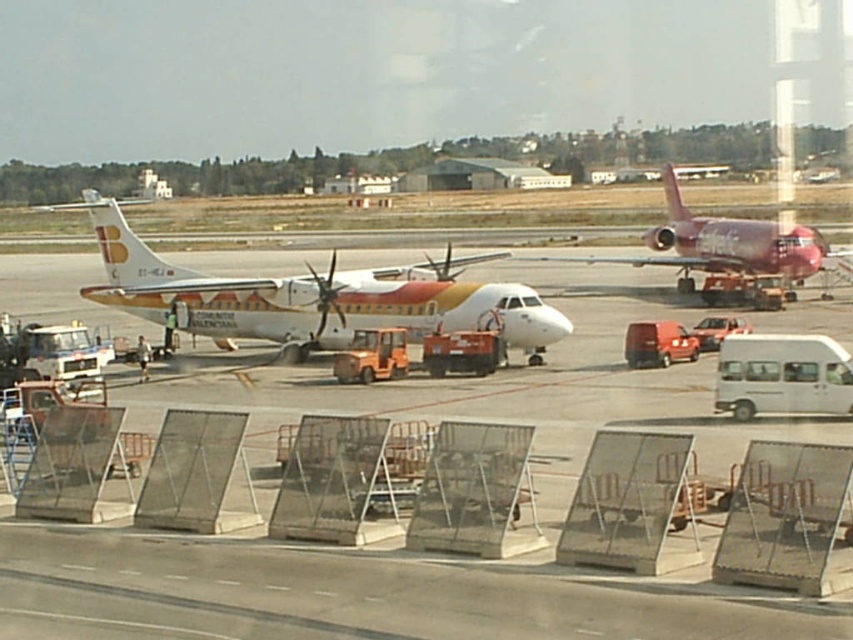
You are a maintenance worker standing at the edge of the white glossy tarmac at center. You need to reach a tool box placed 15 meters away from you. Can you safely walk to the tool box without stepping off the tarmac?

The white glossy tarmac at center is 14.24 meters from viewer. Since the tool box is placed 15 meters away, it is beyond the edge of the tarmac. Therefore, you cannot safely walk to the tool box without stepping off the tarmac.

You are a maintenance worker on the airport tarmac. You need to place a heavy equipment box on the ground between the white glossy tarmac at center and the white glossy airplane at center. Where exactly should you place it?

The white glossy tarmac at center is below the white glossy airplane at center, so you should place the heavy equipment box on the white glossy tarmac at center since it is the ground surface beneath the airplane.

You are a passenger standing at the airport tarmac. You see a white glossy airplane at center and a shiny red airplane at center. Which airplane is nearer to you?

The white glossy airplane at center is closer to you than the shiny red airplane at center.